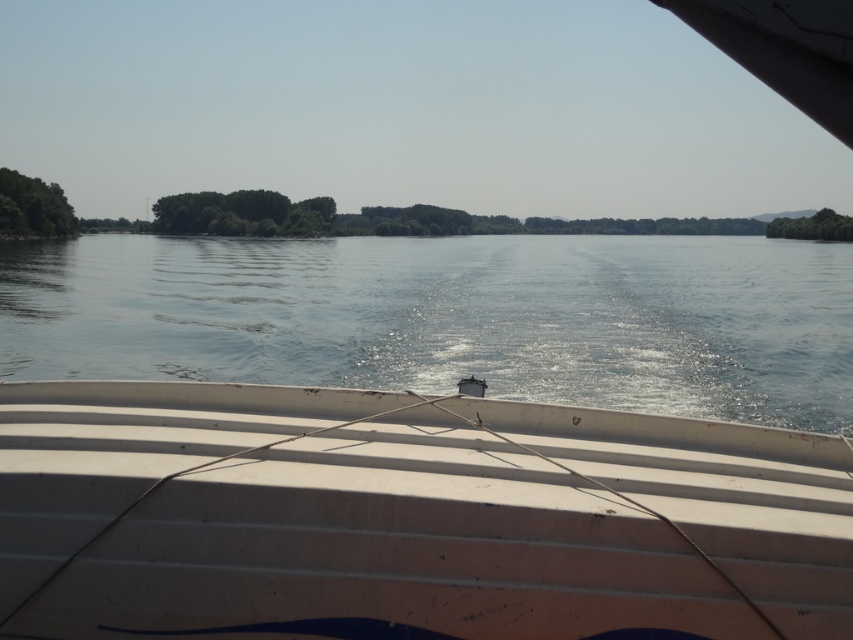
Question: Which point is closer to the camera?

Choices:
 (A) clear blue water at center
 (B) white corrugated plastic boat at center

Answer: (B)

Question: From the image, what is the correct spatial relationship of white corrugated plastic boat at center in relation to clear blue water at center?

Choices:
 (A) right
 (B) left

Answer: (A)

Question: Which point is closer to the camera?

Choices:
 (A) white corrugated plastic boat at center
 (B) clear blue water at center

Answer: (A)

Question: Among these objects, which one is nearest to the camera?

Choices:
 (A) clear blue water at center
 (B) white corrugated plastic boat at center

Answer: (B)

Question: Can you confirm if white corrugated plastic boat at center is bigger than clear blue water at center?

Choices:
 (A) no
 (B) yes

Answer: (A)

Question: Can you confirm if white corrugated plastic boat at center is wider than clear blue water at center?

Choices:
 (A) no
 (B) yes

Answer: (A)